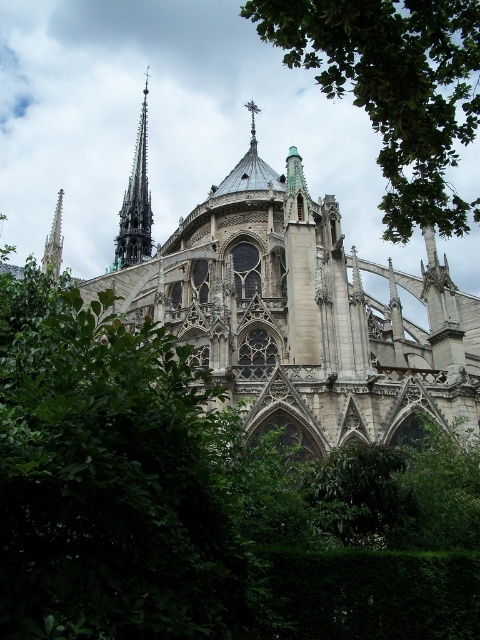
Question: Is green leafy tree at upper center positioned in front of smooth stone spire at left?

Choices:
 (A) yes
 (B) no

Answer: (A)

Question: Can you confirm if stone church at center is thinner than green leafy tree at upper center?

Choices:
 (A) no
 (B) yes

Answer: (B)

Question: Which point is closer to the camera?

Choices:
 (A) (364, 13)
 (B) (128, 196)

Answer: (A)

Question: Considering the relative positions of dark gray stone spire at upper left and smooth stone spire at left in the image provided, where is dark gray stone spire at upper left located with respect to smooth stone spire at left?

Choices:
 (A) below
 (B) above

Answer: (B)

Question: Which object is the farthest from the smooth stone spire at left?

Choices:
 (A) green leafy tree at upper center
 (B) stone church at center
 (C) dark gray stone spire at upper left

Answer: (C)

Question: Among these points, which one is nearest to the camera?

Choices:
 (A) (384, 218)
 (B) (48, 259)

Answer: (A)